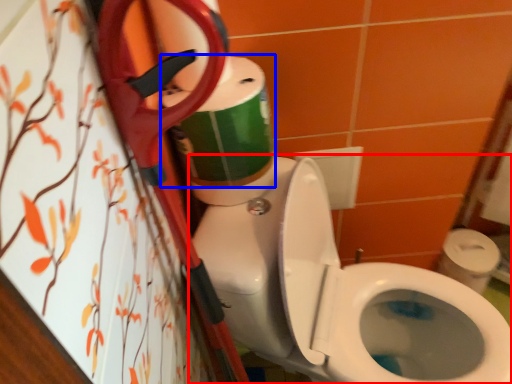
Question: Which point is closer to the camera, toilet (highlighted by a red box) or toilet paper (highlighted by a blue box)?

Choices:
 (A) toilet
 (B) toilet paper

Answer: (A)